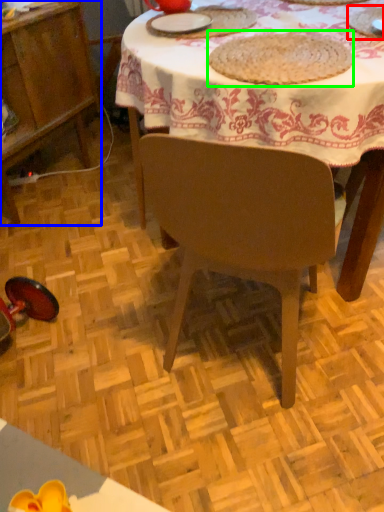
Question: Which is farther away from tableware (highlighted by a red box)? cabinetry (highlighted by a blue box) or food (highlighted by a green box)?

Choices:
 (A) cabinetry
 (B) food

Answer: (A)